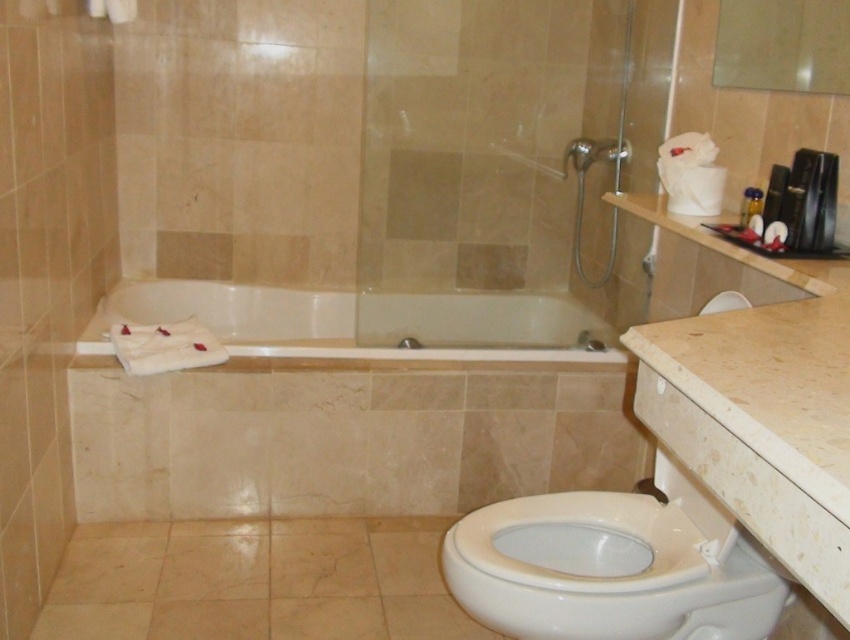
You are designing a bathroom layout and need to ensure that the white glossy bathtub at center can fit through a doorway that is the same width as the matte silver showerhead at upper center. Can the bathtub fit through the doorway?

The white glossy bathtub at center is wider than the matte silver showerhead at upper center, so it cannot fit through a doorway that is the same width as the showerhead.

You are designing a bathroom layout and need to place a new plant pot between the white glossy toilet bowl at lower right and the matte silver showerhead at upper center. Which object should the plant pot be closer to if it needs to be placed closer to the larger object?

The white glossy toilet bowl at lower right is larger in size than the matte silver showerhead at upper center, so the plant pot should be placed closer to the white glossy toilet bowl at lower right.